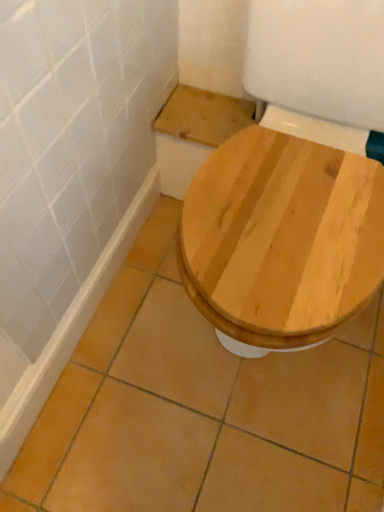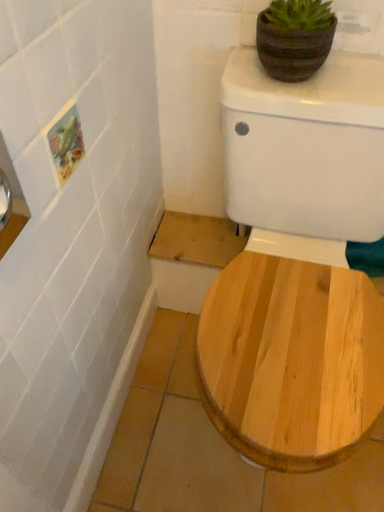
Question: Which way did the camera rotate in the video?

Choices:
 (A) rotated upward
 (B) rotated downward

Answer: (A)